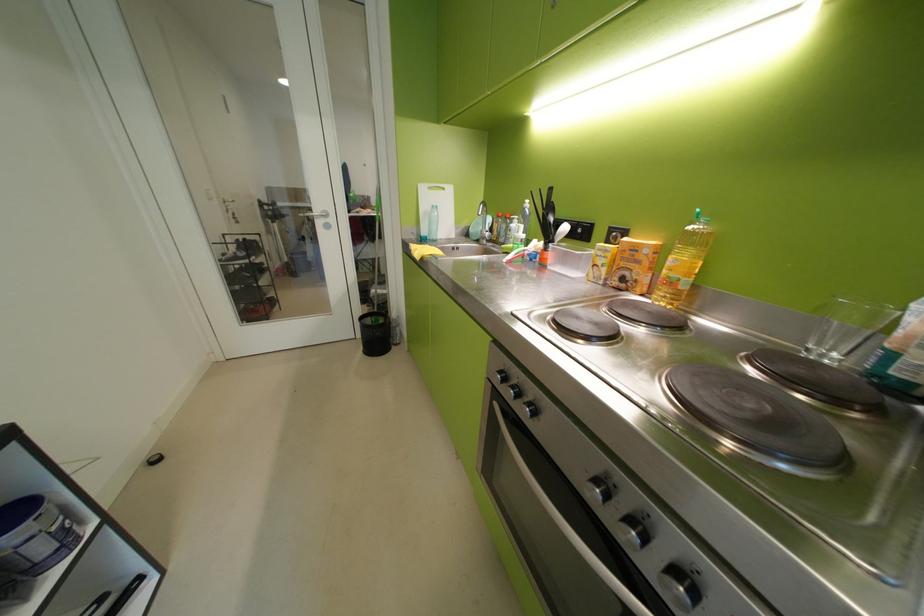
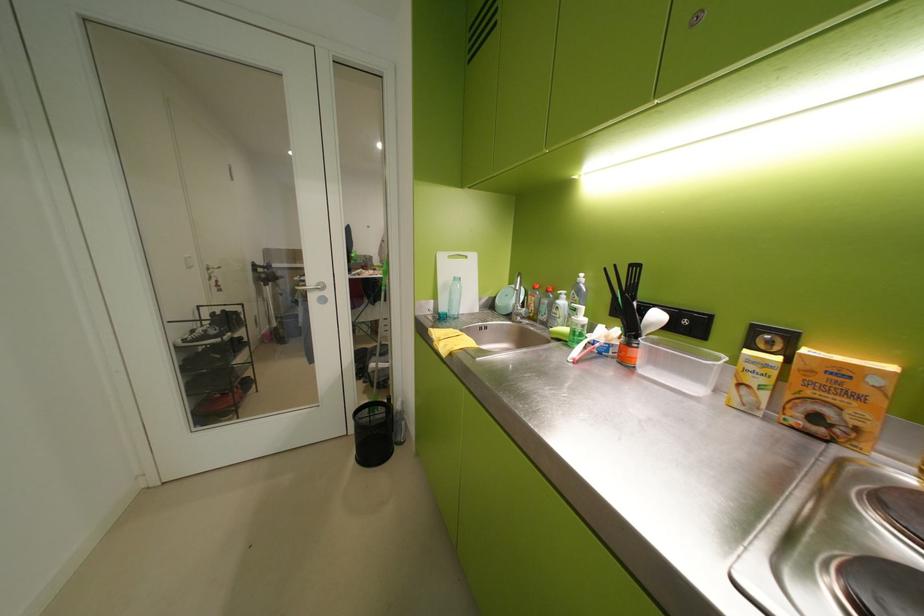
In the second image, find the point that corresponds to point 433,190 in the first image.

(453, 259)